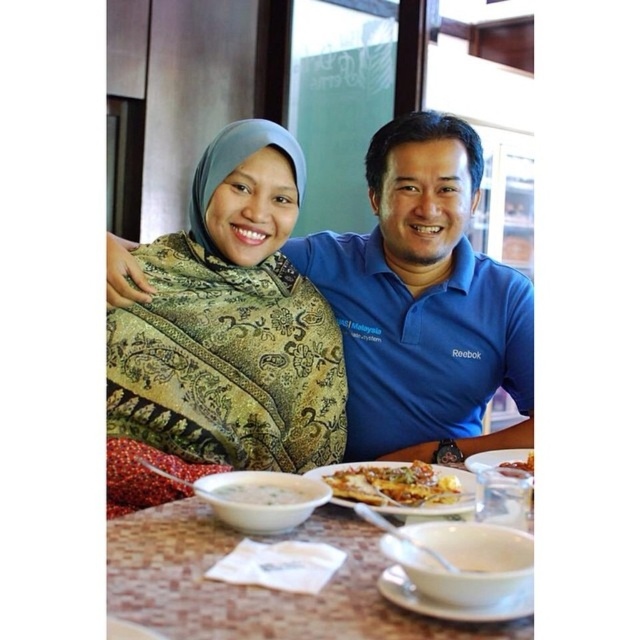
Question: Which point is closer to the camera?

Choices:
 (A) (272, 496)
 (B) (236, 515)

Answer: (B)

Question: Which object is positioned farthest from the marble-patterned table at center?

Choices:
 (A) white ceramic plate at lower center
 (B) golden crispy pizza at center

Answer: (B)

Question: Can you confirm if marble-patterned table at center is thinner than golden crispy pizza at center?

Choices:
 (A) no
 (B) yes

Answer: (A)

Question: Does white matte bowl at lower center have a smaller size compared to white creamy soup at lower center?

Choices:
 (A) no
 (B) yes

Answer: (A)

Question: Which is nearer to the blue cotton shirt at center?

Choices:
 (A) white matte bowl at lower center
 (B) golden crispy pizza at center
 (C) marble-patterned table at center

Answer: (B)

Question: In this image, where is blue cotton shirt at center located relative to white ceramic plate at lower center?

Choices:
 (A) above
 (B) below

Answer: (A)